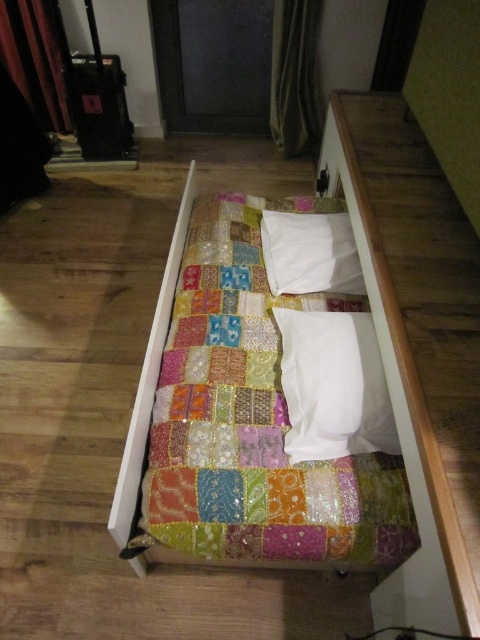
You are a delivery robot that is 12 inches wide. You are in the room and need to move from the entrance to the suitcase in the background. There are two white soft pillows on the bed. Can you pass between the white soft pillow at center and the white soft pillow at upper center?

The distance between the white soft pillow at center and the white soft pillow at upper center is 14.47 inches. Since the robot is 12 inches wide, it can pass between them as the space is wider than the robot.

You are standing in a small room and see the patchwork fabric bed at center and the white soft pillow at upper center. Which object is closer to the ceiling?

The white soft pillow at upper center is closer to the ceiling because it is positioned above the patchwork fabric bed at center.